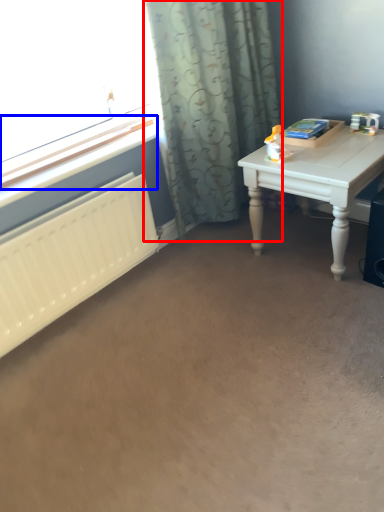
Question: Among these objects, which one is farthest to the camera, curtain (highlighted by a red box) or window sill (highlighted by a blue box)?

Choices:
 (A) curtain
 (B) window sill

Answer: (B)